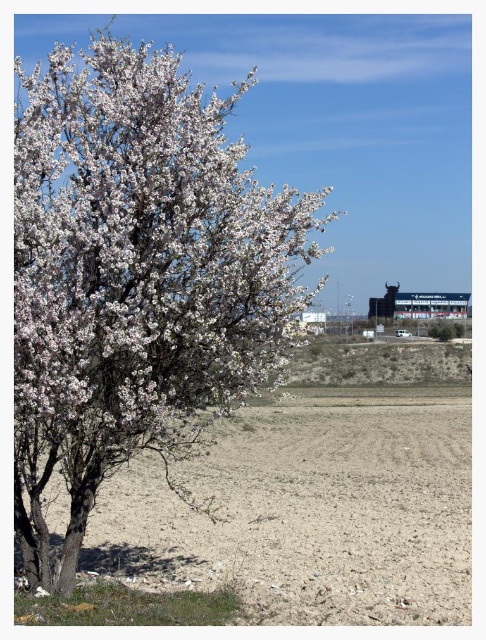
Question: Can you confirm if white matte tree at left is positioned below dull brown soil at lower left?

Choices:
 (A) yes
 (B) no

Answer: (B)

Question: Which object is closer to the camera taking this photo?

Choices:
 (A) white matte tree at left
 (B) dull brown soil at lower left

Answer: (A)

Question: Can you confirm if white matte tree at left is smaller than dull brown soil at lower left?

Choices:
 (A) yes
 (B) no

Answer: (B)

Question: Which object appears closest to the camera in this image?

Choices:
 (A) white matte tree at left
 (B) dull brown soil at lower left

Answer: (A)

Question: In this image, where is white matte tree at left located relative to dull brown soil at lower left?

Choices:
 (A) above
 (B) below

Answer: (A)